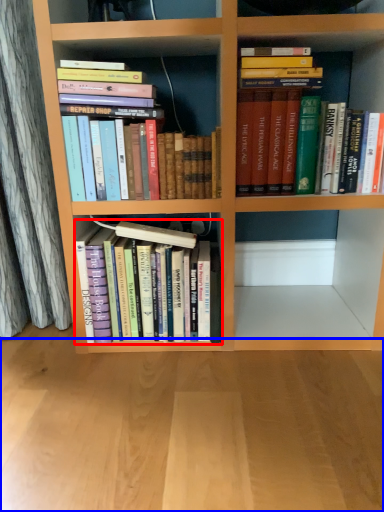
Question: Which point is closer to the camera, book (highlighted by a red box) or plain (highlighted by a blue box)?

Choices:
 (A) book
 (B) plain

Answer: (B)